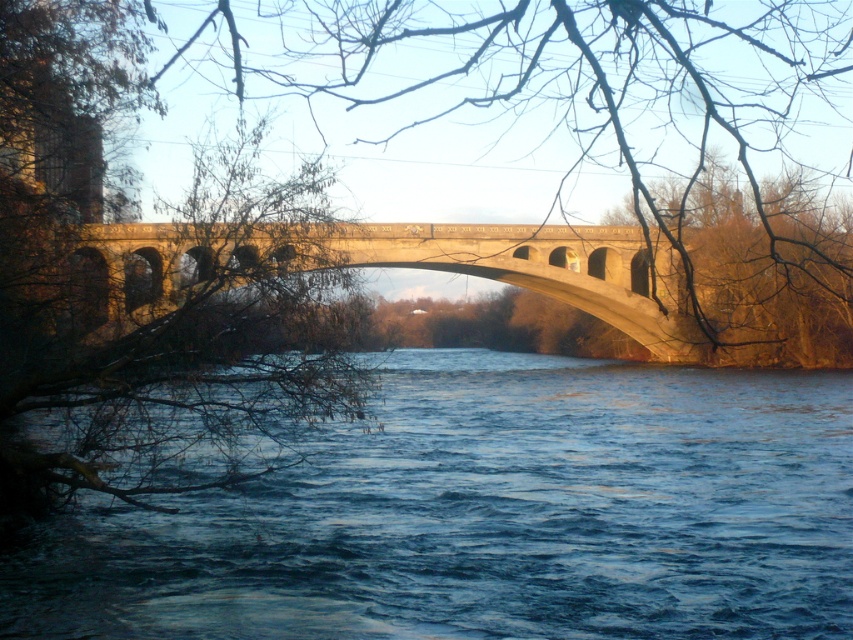
You are standing at the riverside and want to take a photo of the stone bridge. To ensure the blue water at center is perfectly centered in your shot, where should you position your camera? Use the 2D coordinate system provided in the scene description to answer.

The blue water at center should be positioned at the coordinate point 0.808 on the x axis and 0.576 on the y axis to ensure it is perfectly centered in the photo.

You are standing on the riverside path and want to take a photo of the blue water at center and the concrete bridge at center. Which object should you position to your left to capture both in the frame?

You should position the concrete bridge at center to your left because the blue water at center is to the right of the concrete bridge at center, so placing the bridge on your left will allow both to be included in the frame.

You are standing at the riverside and want to take a photo of the blue water at center and the brown textured tree at center. Which object is closer to you, the photographer?

The blue water at center is closer to you than the brown textured tree at center because it is further to the viewer.